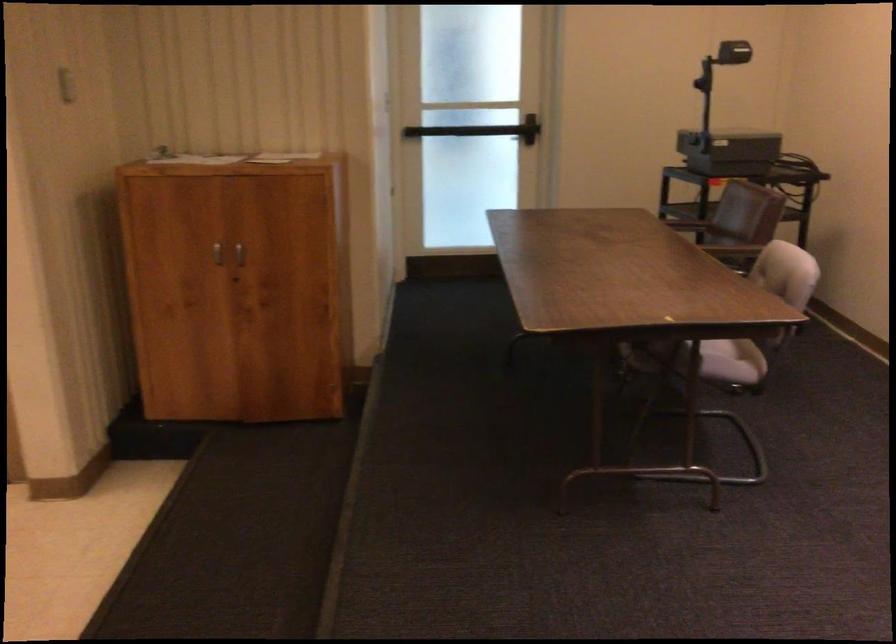
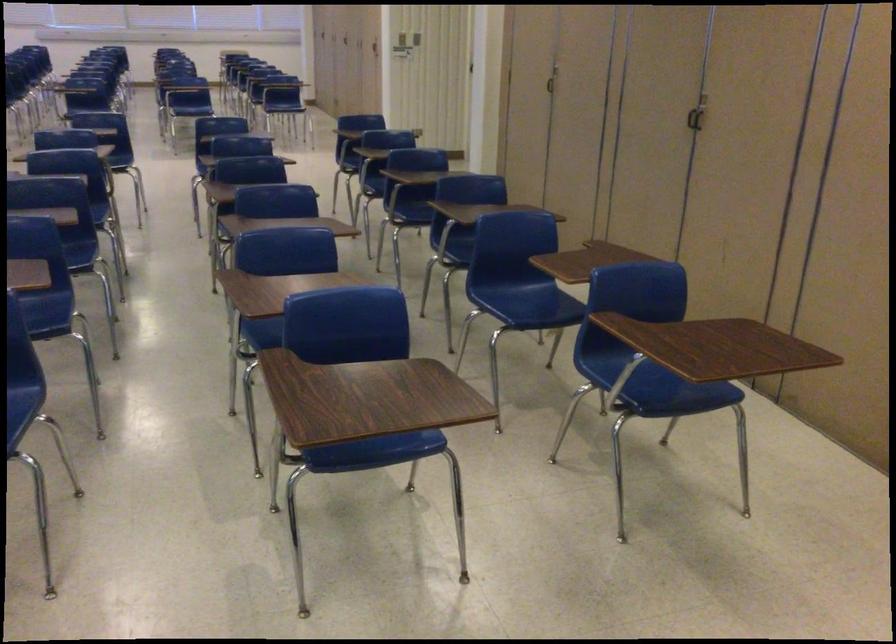
Question: The images are taken continuously from a first-person perspective. In which direction is your viewpoint rotating?

Choices:
 (A) Left
 (B) Right
 (C) Up
 (D) Down

Answer: (A)